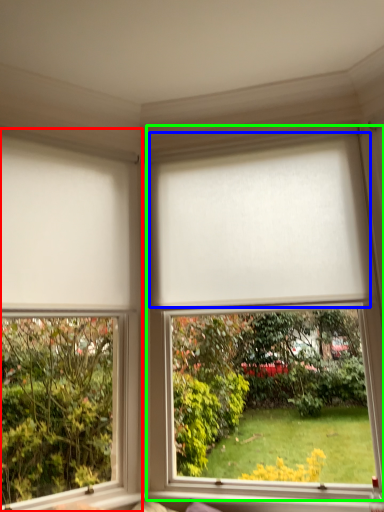
Question: Considering the real-world distances, which object is closest to window (highlighted by a red box)? blind (highlighted by a blue box) or window (highlighted by a green box).

Choices:
 (A) blind
 (B) window

Answer: (B)